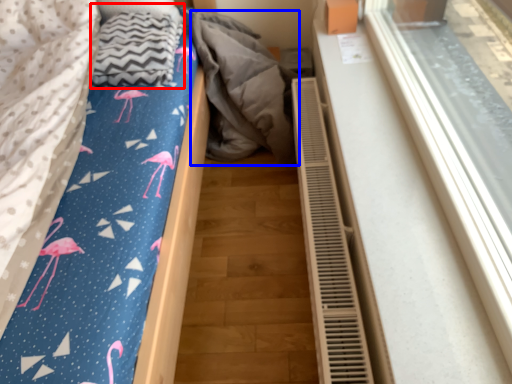
Question: Which of the following is the closest to the observer, blanket (highlighted by a red box) or material (highlighted by a blue box)?

Choices:
 (A) blanket
 (B) material

Answer: (A)